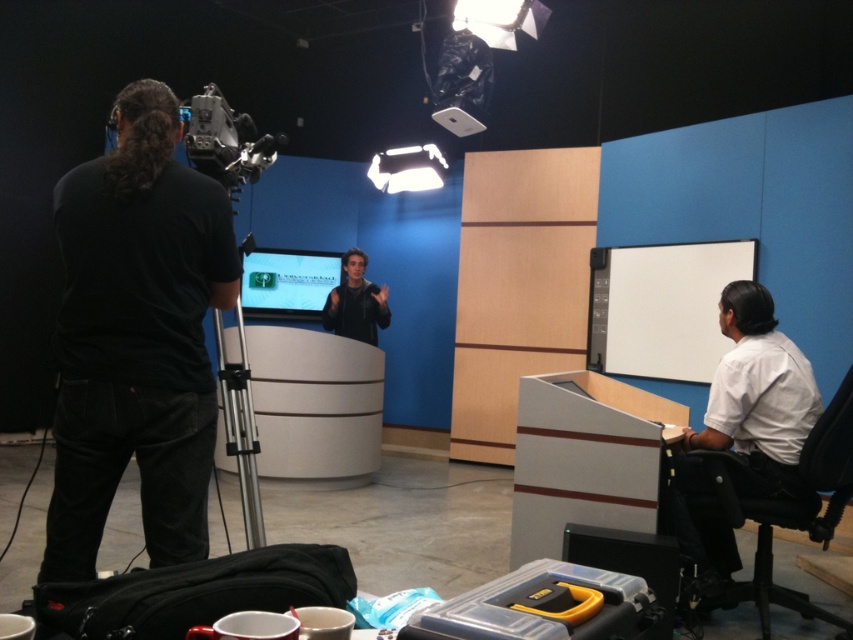
You are standing at the point labeled point (241, 376) in the studio. You want to move to the point labeled point (840, 637). Which direction should you move to reach your destination?

To move from point (241, 376) to point (840, 637), you should move towards the upper right direction since the destination point is behind the starting point.

You are setting up a photo shoot in this studio and need to place a large equipment box that requires 2 square meters of space. You have to choose between placing it next to the black leather chair at lower right or the black matte jacket at center. Which location would allow the box to fit without overlapping other objects?

The black leather chair at lower right is bigger than the black matte jacket at center, so placing the equipment box next to the black leather chair at lower right would provide more space and likely accommodate the 2 square meters requirement without overlapping other objects.

You are an assistant in the studio. You need to adjust the focus of the camera so that both the white matte projection screen at right and the white plastic projector at upper center are clearly visible. Which object should you focus on first to ensure both are in focus?

The white matte projection screen at right is closer to the viewer than the white plastic projector at upper center. To ensure both are in focus, you should focus on the white plastic projector at upper center first, as it is farther away, allowing the depth of field to cover the closer screen.